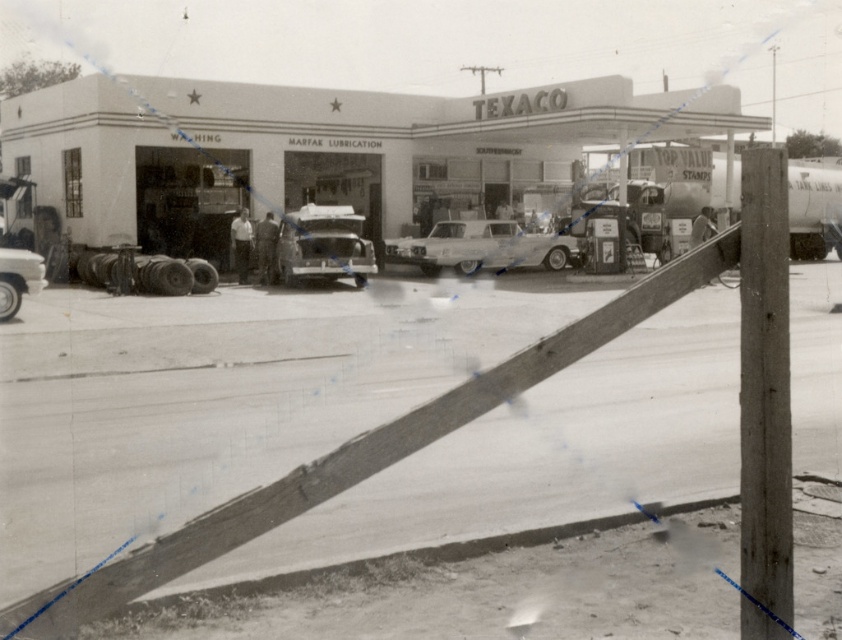
You are a photographer trying to capture both cars in a single frame. The shiny chrome car at center is narrower than the shiny silver car at lower left. Which car should you position closer to the camera to ensure both fit in the frame?

The shiny chrome car at center has a lesser width compared to the shiny silver car at lower left. To ensure both fit in the frame, position the narrower shiny chrome car at center closer to the camera so that its apparent size matches the wider shiny silver car at lower left.